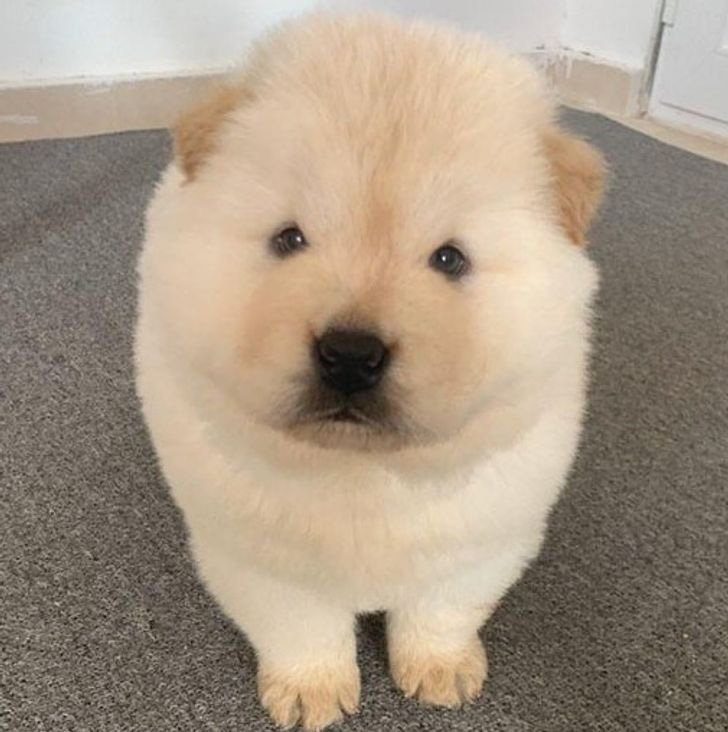
The height and width of the screenshot is (732, 728). I want to click on multi-colored flooring, so click(x=30, y=446).